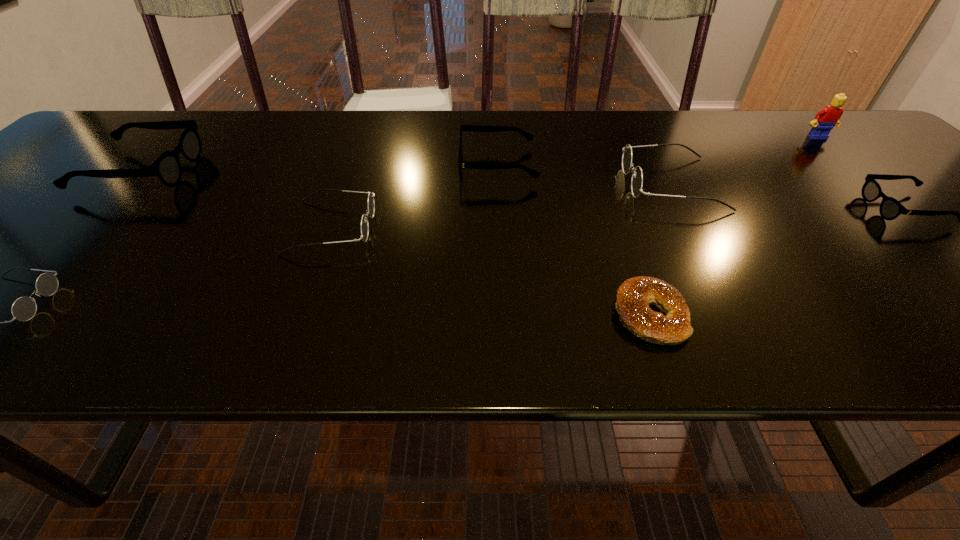
The height and width of the screenshot is (540, 960). In order to click on empty space between the third spectacles from right to left and the biggest dark spectacles in this screenshot , I will do `click(585, 174)`.

You are a GUI agent. You are given a task and a screenshot of the screen. Output one action in this format:
    pyautogui.click(x=<x>, y=<y>)
    Task: Click on the vacant space in between the biggest dark spectacles and the leftmost black spectacles
    This screenshot has height=540, width=960.
    Given the screenshot: What is the action you would take?
    pyautogui.click(x=406, y=177)

Where is `blank region between the bagel and the second biggest dark spectacles`? The height and width of the screenshot is (540, 960). blank region between the bagel and the second biggest dark spectacles is located at coordinates (491, 271).

Locate which object ranks fourth in proximity to the biggest dark spectacles. Please provide its 2D coordinates. Your answer should be formatted as a tuple, i.e. [(x, y)], where the tuple contains the x and y coordinates of a point satisfying the conditions above.

[(827, 118)]

This screenshot has height=540, width=960. I want to click on object that stands as the sixth closest to the biggest black spectacles, so 890,208.

What are the coordinates of `spectacles that is the nearest to the bagel` in the screenshot? It's located at (637, 177).

Identify which spectacles is the second closest to the bagel. Please provide its 2D coordinates. Your answer should be formatted as a tuple, i.e. [(x, y)], where the tuple contains the x and y coordinates of a point satisfying the conditions above.

[(476, 128)]

Locate an element on the screen. black spectacles that can be found as the closest to the nearest spectacles is located at coordinates 167,167.

The height and width of the screenshot is (540, 960). Identify the location of black spectacles that is the second closest to the leftmost black spectacles. (890, 208).

Identify which dark spectacles is the second closest to the fourth spectacles from left to right. Please provide its 2D coordinates. Your answer should be formatted as a tuple, i.e. [(x, y)], where the tuple contains the x and y coordinates of a point satisfying the conditions above.

[(637, 177)]